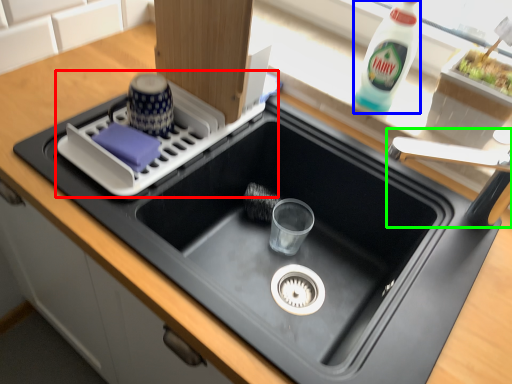
Question: Estimate the real-world distances between objects in this image. Which object is closer to appliance (highlighted by a red box), bottle (highlighted by a blue box) or faucet (highlighted by a green box)?

Choices:
 (A) bottle
 (B) faucet

Answer: (A)